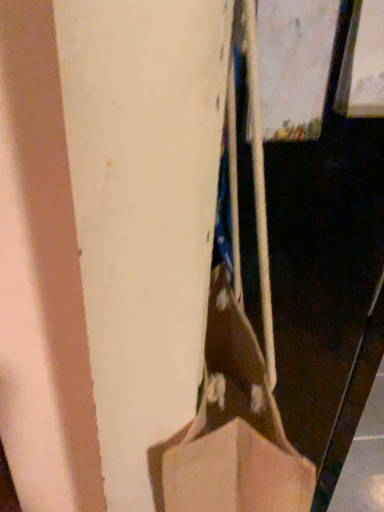
This screenshot has height=512, width=384. What do you see at coordinates (239, 373) in the screenshot?
I see `brown paper bag at center` at bounding box center [239, 373].

Find the location of a particular element. The image size is (384, 512). brown paper bag at center is located at coordinates (239, 373).

You are a GUI agent. You are given a task and a screenshot of the screen. Output one action in this format:
    pyautogui.click(x=<x>, y=<y>)
    Task: Click on the brown paper bag at center
    
    Given the screenshot: What is the action you would take?
    pyautogui.click(x=239, y=373)